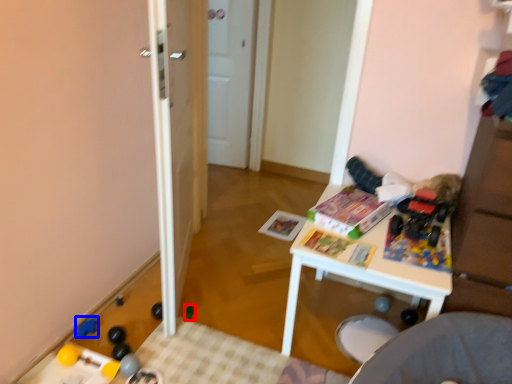
Question: Which point is closer to the camera, toy (highlighted by a red box) or toy (highlighted by a blue box)?

Choices:
 (A) toy
 (B) toy

Answer: (B)